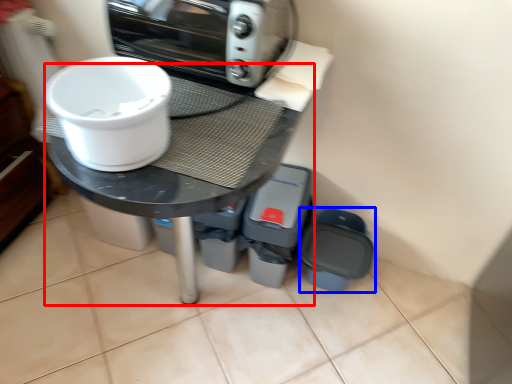
Question: Which object is closer to the camera taking this photo, round table (highlighted by a red box) or appliance (highlighted by a blue box)?

Choices:
 (A) round table
 (B) appliance

Answer: (A)